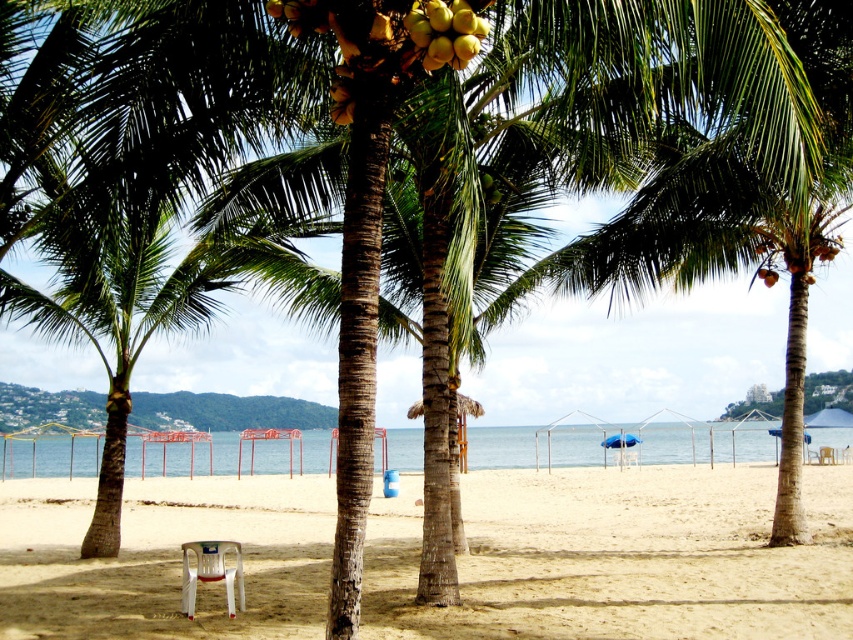
What do you see at coordinates (445, 33) in the screenshot? Image resolution: width=853 pixels, height=640 pixels. I see `yellow matte coconut at upper center` at bounding box center [445, 33].

Does yellow matte coconut at upper center appear over white plastic chair at lower left?

Yes, yellow matte coconut at upper center is above white plastic chair at lower left.

Is point (431, 68) positioned after point (190, 541)?

No, (431, 68) is closer to viewer.

The height and width of the screenshot is (640, 853). In order to click on yellow matte coconut at upper center in this screenshot , I will do click(x=445, y=33).

Is yellow matte coconut at upper center positioned in front of white plastic beach chair at center?

Yes, yellow matte coconut at upper center is in front of white plastic beach chair at center.

Is yellow matte coconut at upper center thinner than white plastic beach chair at center?

Indeed, yellow matte coconut at upper center has a lesser width compared to white plastic beach chair at center.

Locate an element on the screen. This screenshot has width=853, height=640. yellow matte coconut at upper center is located at coordinates (445, 33).

Which is in front, point (291, 557) or point (225, 596)?

Point (225, 596) is in front.

Can you confirm if sandy beige at center is positioned to the left of white plastic chair at lower left?

Incorrect, sandy beige at center is not on the left side of white plastic chair at lower left.

Locate an element on the screen. The width and height of the screenshot is (853, 640). sandy beige at center is located at coordinates (619, 556).

The height and width of the screenshot is (640, 853). Find the location of `sandy beige at center`. sandy beige at center is located at coordinates (619, 556).